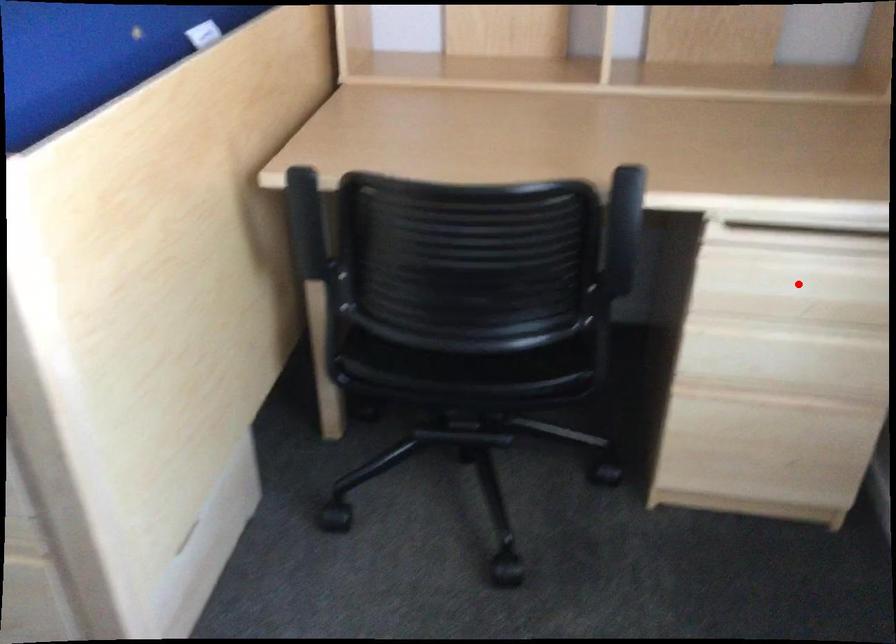
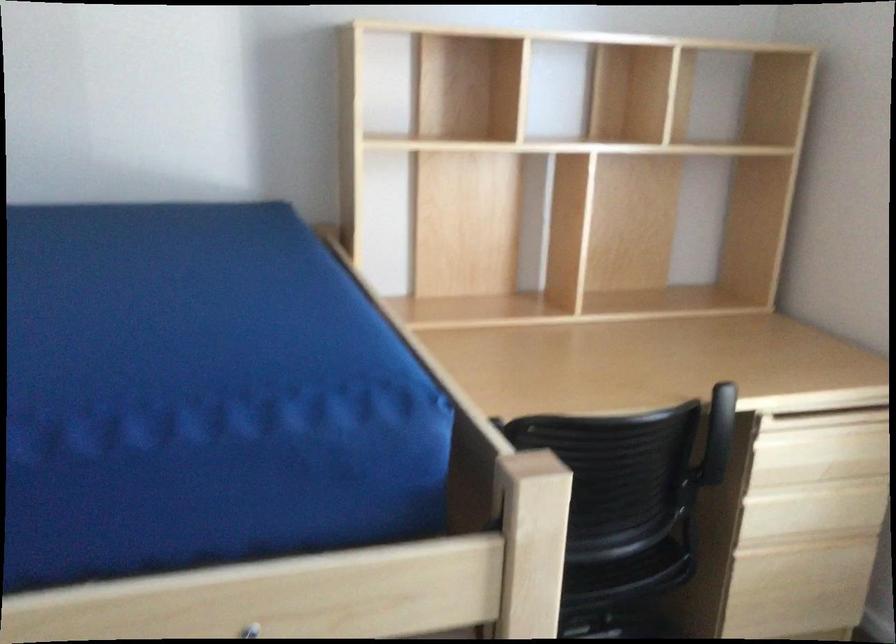
Question: I am providing you with two images of the same scene from different viewpoints. In image1, a red point is highlighted. Considering the same 3D point in image2, which of the following is correct?

Choices:
 (A) It is closer
 (B) It is farther

Answer: (B)